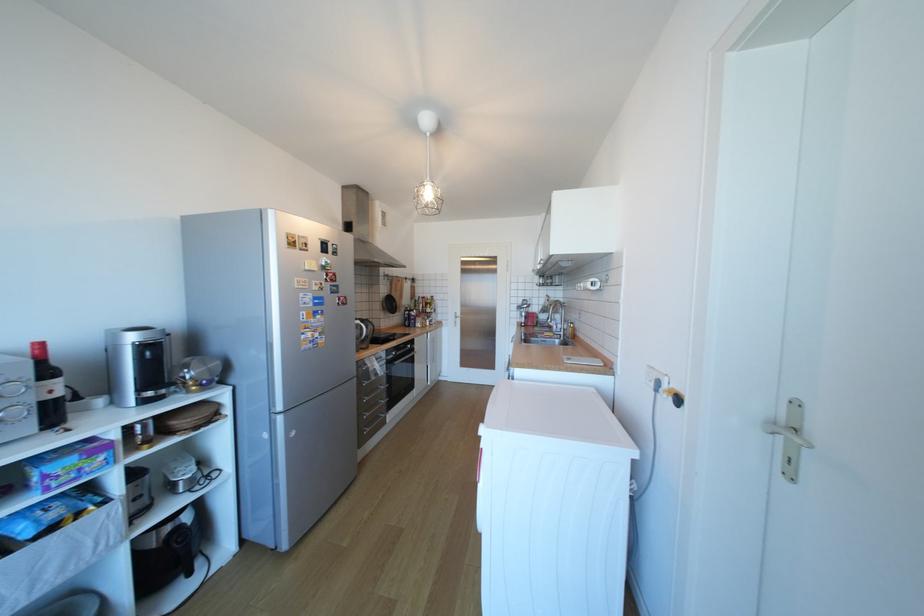
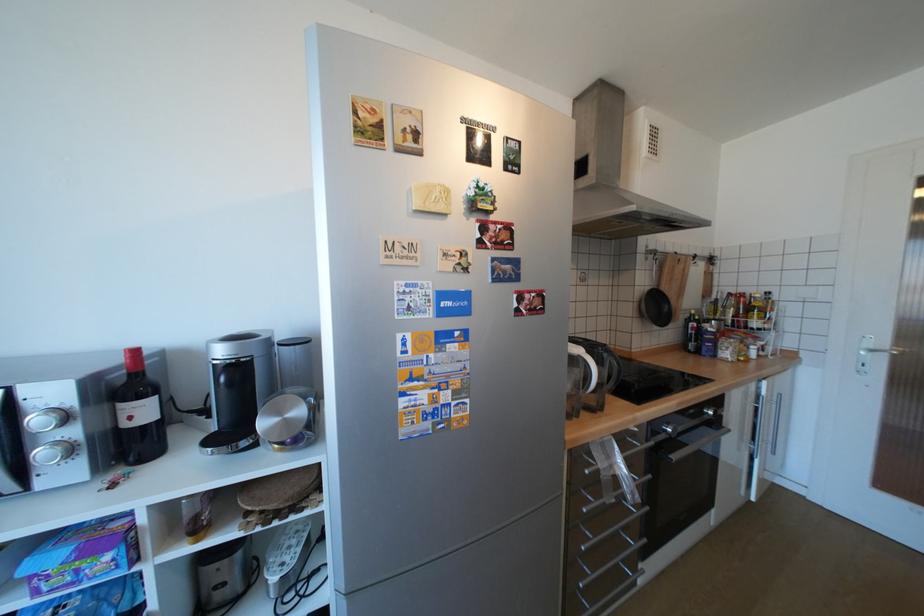
Locate, in the second image, the point that corresponds to (x=59, y=392) in the first image.

(140, 418)